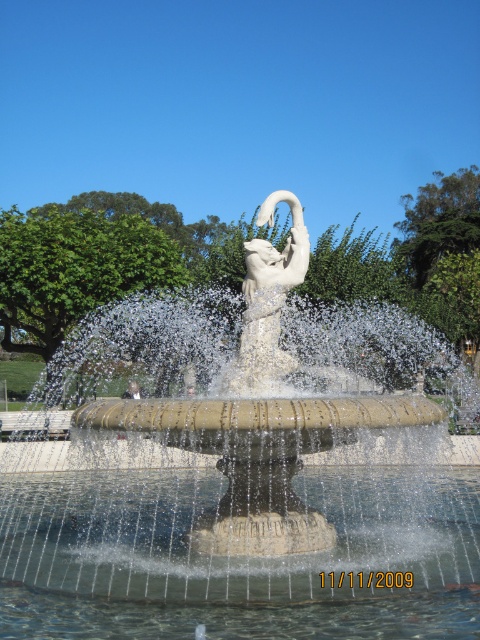
Question: Is white stone fountain at center above white stone swan at center?

Choices:
 (A) no
 (B) yes

Answer: (B)

Question: Is clear water at fountain center smaller than white stone swan at center?

Choices:
 (A) no
 (B) yes

Answer: (A)

Question: Which point appears closest to the camera in this image?

Choices:
 (A) (x=472, y=552)
 (B) (x=406, y=419)

Answer: (B)

Question: Which point appears closest to the camera in this image?

Choices:
 (A) (162, 545)
 (B) (108, 348)
 (C) (251, 240)

Answer: (A)

Question: Does white stone fountain at center have a lesser width compared to clear water at fountain center?

Choices:
 (A) no
 (B) yes

Answer: (A)

Question: Considering the real-world distances, which object is closest to the white stone swan at center?

Choices:
 (A) clear water at fountain center
 (B) white stone fountain at center

Answer: (A)